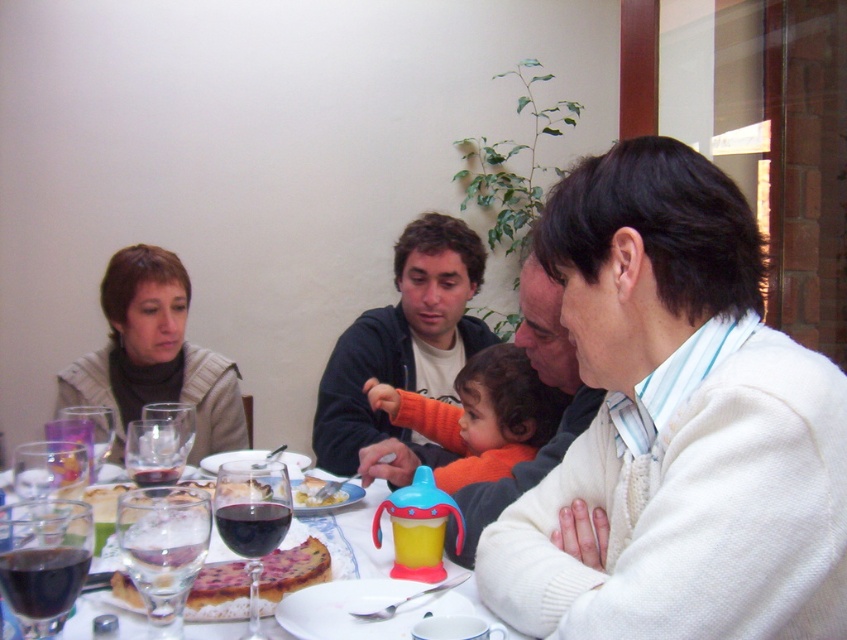
You are a guest at this family gathering and need to place your phone on the table. The table has a white tablecloth. You want to place your phone on the tablecloth but avoid the area where the foamy glass at lower left is located. Which coordinates should you avoid?

You should avoid placing your phone near the coordinates point (x=163, y=548) where the foamy glass at lower left is located.

You are a server in a restaurant and need to place a new plate on the table. The plate is 15 cm in diameter. There is space between the translucent glass tableware at center and the dark glass wine at lower left. Can you fit the plate there without touching either item?

The translucent glass tableware at center might be wider than dark glass wine at lower left, so the space between them may be insufficient for the 15 cm plate. Check the actual distance before placing the plate.

You are a dinner guest at the table and want to place your napkin on the wider glass item. Which one should you choose between the translucent glass tableware at center and the transparent glass at center?

The translucent glass tableware at center is wider than the transparent glass at center, so you should place your napkin on the translucent glass tableware at center.